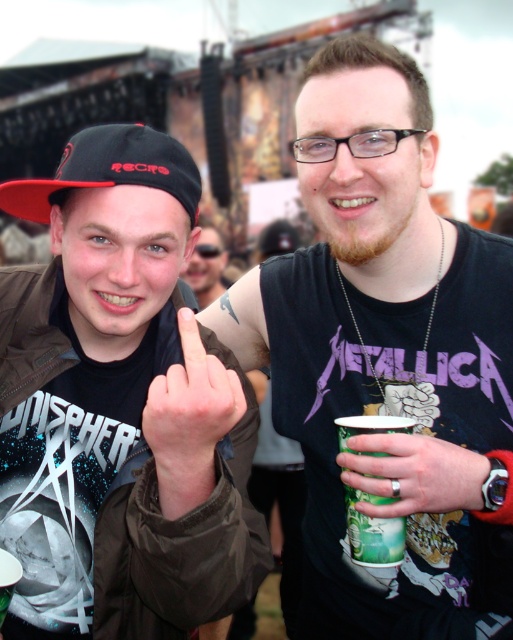
You are at a music festival and see the green paper cup at center and the skinny finger at center. What is the position of the green paper cup relative to the skinny finger?

The green paper cup at center is positioned under the skinny finger at center.